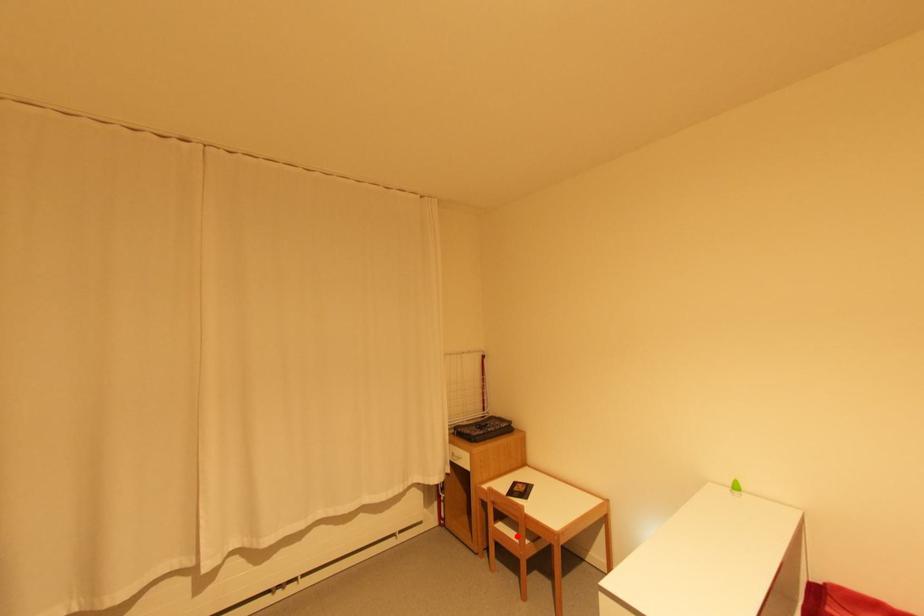
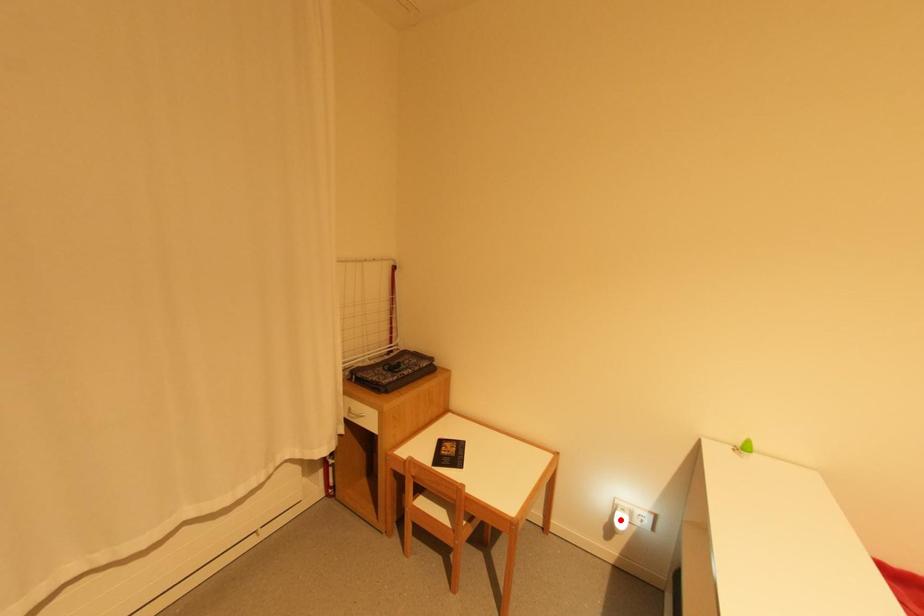
I am providing you with two images of the same scene from different viewpoints. A red point is marked on the first image and another point is marked on the second image. Do the highlighted points in image1 and image2 indicate the same real-world spot?

No